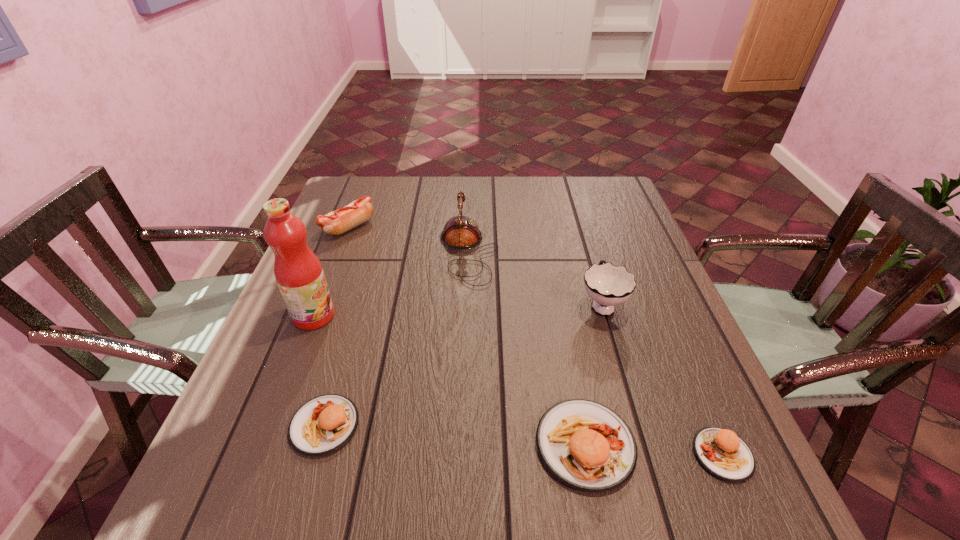
This screenshot has width=960, height=540. Find the location of `patty that is at the left edge`. patty that is at the left edge is located at coordinates (322, 425).

Where is `fruit juice located at the left edge`? This screenshot has width=960, height=540. fruit juice located at the left edge is located at coordinates (298, 272).

This screenshot has height=540, width=960. Identify the location of sausage located at the left edge. (341, 220).

Where is `patty at the right edge`? Image resolution: width=960 pixels, height=540 pixels. patty at the right edge is located at coordinates (721, 452).

You are a GUI agent. You are given a task and a screenshot of the screen. Output one action in this format:
    pyautogui.click(x=<x>, y=<y>)
    Task: Click on the cup at the right edge
    Image resolution: width=960 pixels, height=540 pixels.
    Given the screenshot: What is the action you would take?
    pyautogui.click(x=608, y=285)

Where is `object that is at the far left corner`? The width and height of the screenshot is (960, 540). object that is at the far left corner is located at coordinates (341, 220).

Find the location of a particular element. This screenshot has width=960, height=540. object located in the near left corner section of the desktop is located at coordinates (322, 425).

You are a GUI agent. You are given a task and a screenshot of the screen. Output one action in this format:
    pyautogui.click(x=<x>, y=<y>)
    Task: Click on the object positioned at the near right corner
    This screenshot has height=540, width=960.
    Given the screenshot: What is the action you would take?
    pyautogui.click(x=721, y=452)

The width and height of the screenshot is (960, 540). In the image, there is a desktop. Identify the location of blank space at the far edge. (426, 196).

The height and width of the screenshot is (540, 960). In the image, there is a desktop. Find the location of `free space at the near edge`. free space at the near edge is located at coordinates (517, 428).